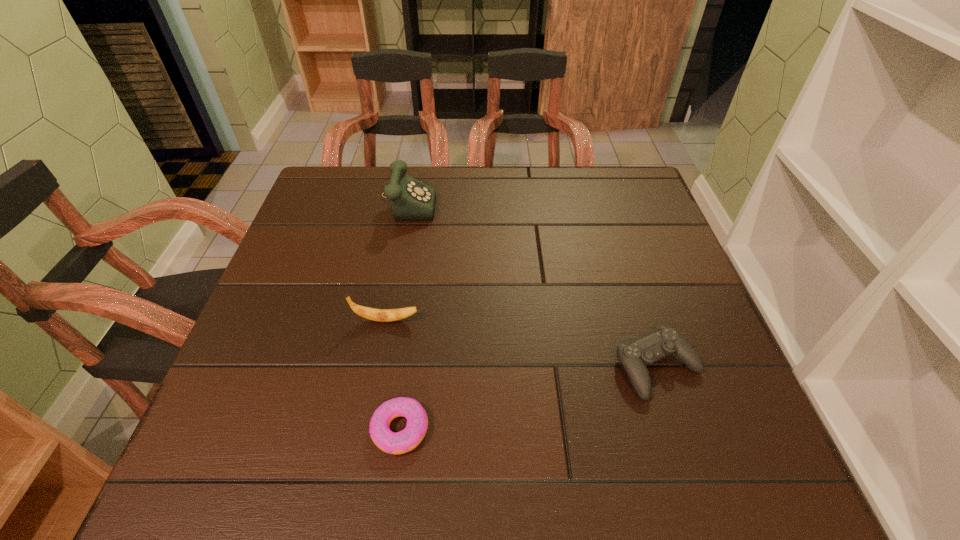
Where is `free location located 0.360m on the left of the rightmost object`? This screenshot has width=960, height=540. free location located 0.360m on the left of the rightmost object is located at coordinates (429, 368).

Identify the location of free spot located on the back of the shortest object. Image resolution: width=960 pixels, height=540 pixels. (415, 317).

At what (x,y) coordinates should I click in order to perform the action: click on object at the far edge. Please return your answer as a coordinate pair (x, y). The width and height of the screenshot is (960, 540). Looking at the image, I should click on (411, 199).

Locate an element on the screen. object positioned at the near edge is located at coordinates (410, 437).

I want to click on object located at the right edge, so click(634, 357).

I want to click on free region at the far edge, so click(375, 184).

Identify the location of free region at the near edge of the desktop. The width and height of the screenshot is (960, 540). [568, 464].

The width and height of the screenshot is (960, 540). I want to click on vacant position at the left edge of the desktop, so click(255, 328).

Locate an element on the screen. This screenshot has height=540, width=960. vacant space at the right edge is located at coordinates (630, 277).

I want to click on free region at the far left corner, so click(x=329, y=195).